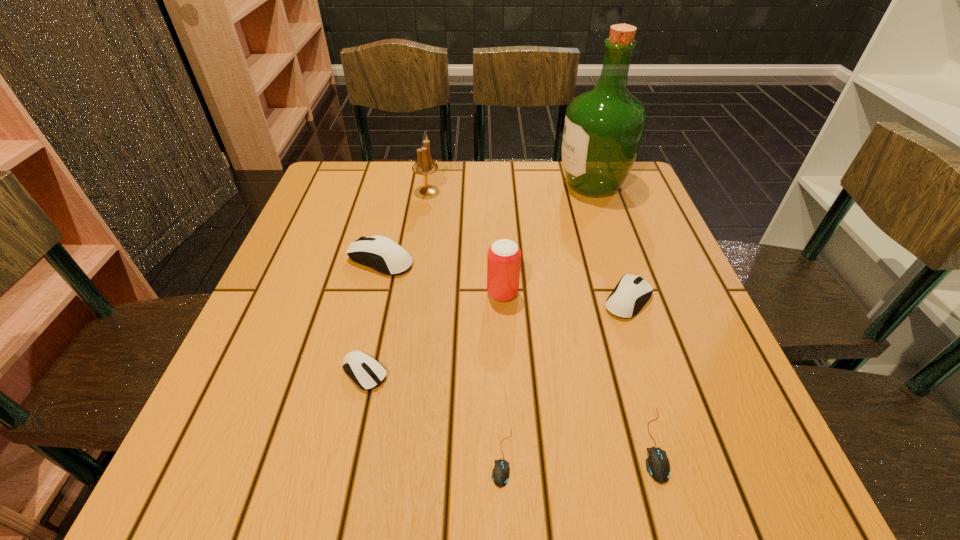
Select which white mouse is the closest to the candle holder. Please provide its 2D coordinates. Your answer should be formatted as a tuple, i.e. [(x, y)], where the tuple contains the x and y coordinates of a point satisfying the conditions above.

[(380, 253)]

Locate an element on the screen. vacant position in the image that satisfies the following two spatial constraints: 1. on the front-facing side of the green liquor; 2. on the front side of the second farthest white mouse is located at coordinates (631, 300).

Where is `vacant space that satisfies the following two spatial constraints: 1. on the back side of the second tallest mouse; 2. on the left side of the third farthest mouse`? The image size is (960, 540). vacant space that satisfies the following two spatial constraints: 1. on the back side of the second tallest mouse; 2. on the left side of the third farthest mouse is located at coordinates (381, 300).